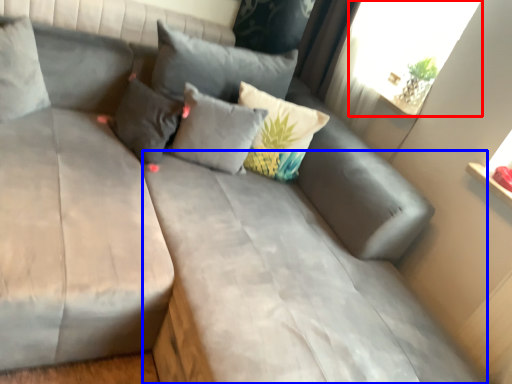
Question: Which of the following is the farthest to the observer, window screen (highlighted by a red box) or mattress (highlighted by a blue box)?

Choices:
 (A) window screen
 (B) mattress

Answer: (A)